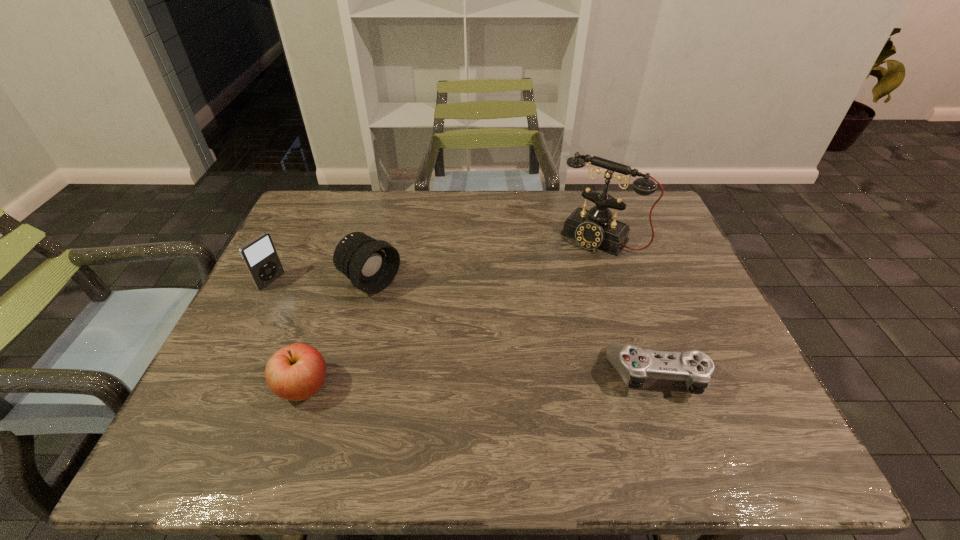
The height and width of the screenshot is (540, 960). I want to click on vacant space in between the iPod and the telephoto lens, so click(322, 281).

I want to click on blank region between the farthest object and the leftmost object, so click(435, 260).

Where is `vacant region between the telephone and the telephoto lens`? vacant region between the telephone and the telephoto lens is located at coordinates 485,260.

Locate an element on the screen. This screenshot has height=540, width=960. vacant area that lies between the fourth tallest object and the telephone is located at coordinates (451, 312).

Choose which object is the nearest neighbor to the telephoto lens. Please provide its 2D coordinates. Your answer should be formatted as a tuple, i.e. [(x, y)], where the tuple contains the x and y coordinates of a point satisfying the conditions above.

[(259, 255)]

You are a GUI agent. You are given a task and a screenshot of the screen. Output one action in this format:
    pyautogui.click(x=<x>, y=<y>)
    Task: Click on the object that is the third closest to the second shortest object
    
    Given the screenshot: What is the action you would take?
    pyautogui.click(x=634, y=364)

Find the location of a particular element. This screenshot has height=540, width=960. free spot that satisfies the following two spatial constraints: 1. on the front side of the telephoto lens; 2. on the left side of the shortest object is located at coordinates (347, 375).

This screenshot has width=960, height=540. In order to click on vacant space that satisfies the following two spatial constraints: 1. on the front side of the telephoto lens; 2. on the left side of the shortest object in this screenshot , I will do `click(347, 375)`.

This screenshot has width=960, height=540. I want to click on free space that satisfies the following two spatial constraints: 1. on the front side of the leftmost object; 2. on the right side of the telephoto lens, so click(x=271, y=282).

Identify the location of free space that satisfies the following two spatial constraints: 1. on the back side of the farthest object; 2. on the left side of the telephoto lens. This screenshot has width=960, height=540. (382, 238).